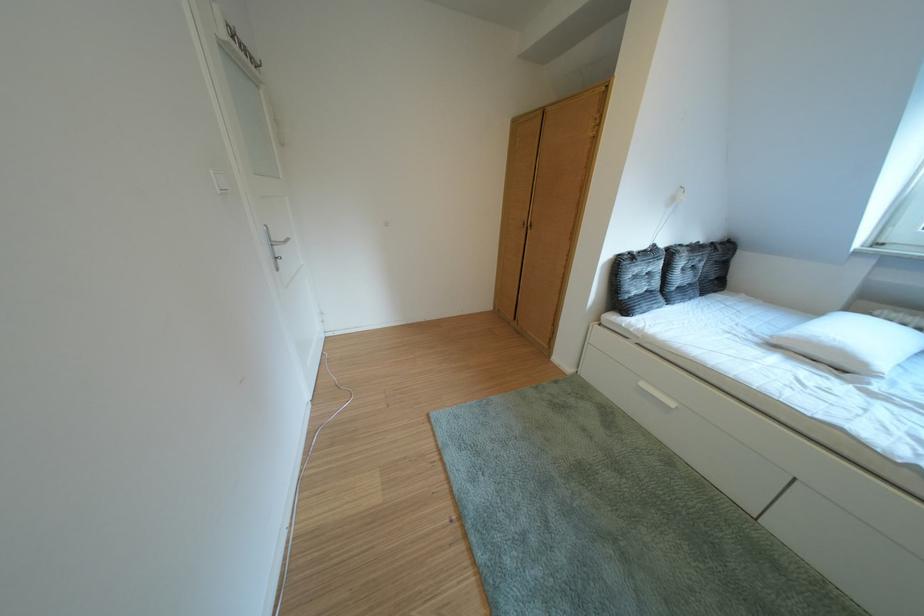
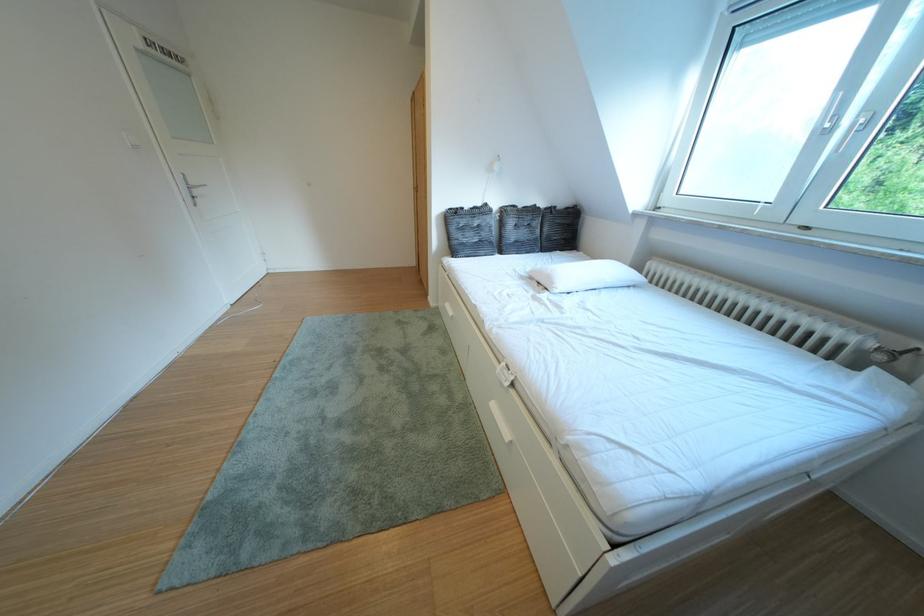
The images are taken continuously from a first-person perspective. In which direction are you moving?

The movement direction of the cameraman is right, backward.